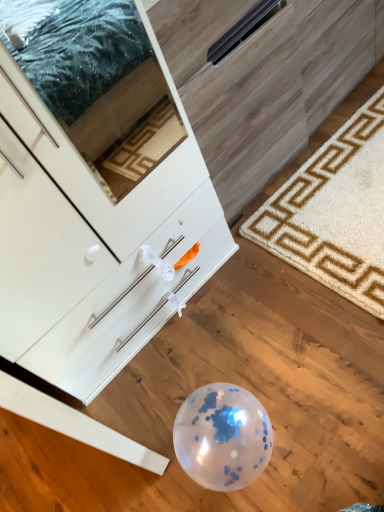
This screenshot has height=512, width=384. Identify the location of empty space that is ontop of white glossy cabinet at lower left (from a real-world perspective). (257, 304).